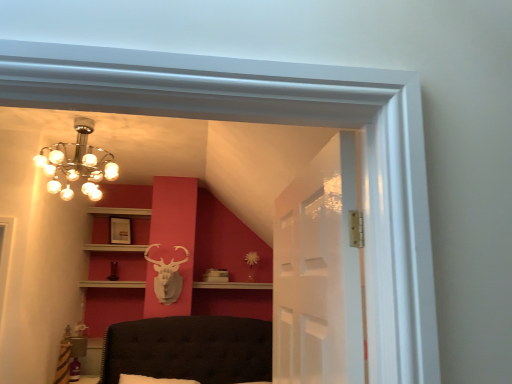
Question: Would you say matte white picture frame at upper center is part of transparent glass door at center's contents?

Choices:
 (A) no
 (B) yes

Answer: (A)

Question: From a real-world perspective, is transparent glass door at center positioned over matte white picture frame at upper center based on gravity?

Choices:
 (A) yes
 (B) no

Answer: (B)

Question: Is transparent glass door at center at the left side of matte white picture frame at upper center?

Choices:
 (A) yes
 (B) no

Answer: (B)

Question: Is transparent glass door at center directly adjacent to matte white picture frame at upper center?

Choices:
 (A) no
 (B) yes

Answer: (A)

Question: Considering the relative positions of transparent glass door at center and matte white picture frame at upper center in the image provided, is transparent glass door at center behind matte white picture frame at upper center?

Choices:
 (A) no
 (B) yes

Answer: (A)

Question: Can you confirm if transparent glass door at center is taller than matte white picture frame at upper center?

Choices:
 (A) no
 (B) yes

Answer: (B)

Question: Can you confirm if matte white picture frame at upper center is taller than white wood shelf at upper center?

Choices:
 (A) no
 (B) yes

Answer: (B)

Question: Is matte white picture frame at upper center facing away from white wood shelf at upper center?

Choices:
 (A) no
 (B) yes

Answer: (A)

Question: Does matte white picture frame at upper center have a smaller size compared to white wood shelf at upper center?

Choices:
 (A) no
 (B) yes

Answer: (B)

Question: From a real-world perspective, is matte white picture frame at upper center below white wood shelf at upper center?

Choices:
 (A) no
 (B) yes

Answer: (A)

Question: Does matte white picture frame at upper center lie in front of white wood shelf at upper center?

Choices:
 (A) yes
 (B) no

Answer: (B)

Question: Is matte white picture frame at upper center at the left side of white wood shelf at upper center?

Choices:
 (A) yes
 (B) no

Answer: (B)

Question: Is white wood shelf at upper center wider than matte white picture frame at upper center?

Choices:
 (A) yes
 (B) no

Answer: (A)